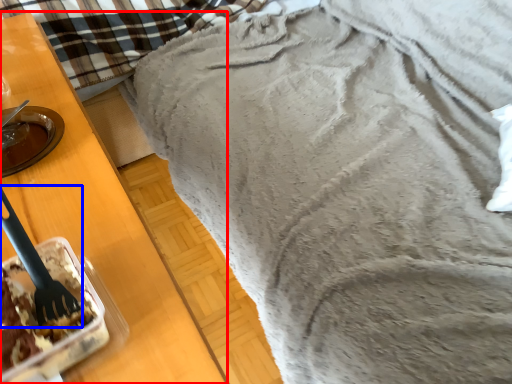
Question: Which object is closer to the camera taking this photo, furniture (highlighted by a red box) or silverware (highlighted by a blue box)?

Choices:
 (A) furniture
 (B) silverware

Answer: (A)